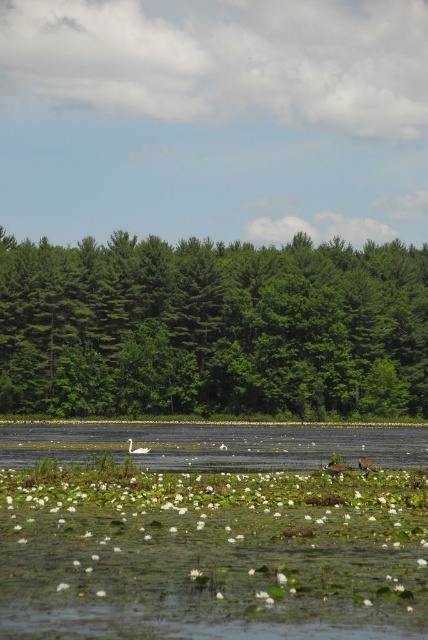
You are a wildlife photographer standing on the lakeshore. You want to take a photo of the white matte duck at center and the green leafy trees at center in the background. Given that your camera has a depth of field that can focus on objects within 50 meters of each other, will both subjects be in focus?

The distance between the green leafy trees at center and the white matte duck at center is 56.05 meters, which exceeds the camera depth of field range of 50 meters. Therefore, both subjects cannot be in focus simultaneously.

You are standing at the edge of the water and want to reach the green leafy trees at center. Do you need to walk through the clear water at center first?

The green leafy trees at center are closer to you than the clear water at center, so you can reach them without walking through the clear water at center.

You are a photographer planning to capture the scene with a wide angle lens. You need to ensure that both the clear water at center and the white matte duck at center are fully visible in the frame. Based on their relative sizes, which object will occupy more of the horizontal space in the photo?

The clear water at center has a greater width than the white matte duck at center, so it will occupy more horizontal space in the photo.